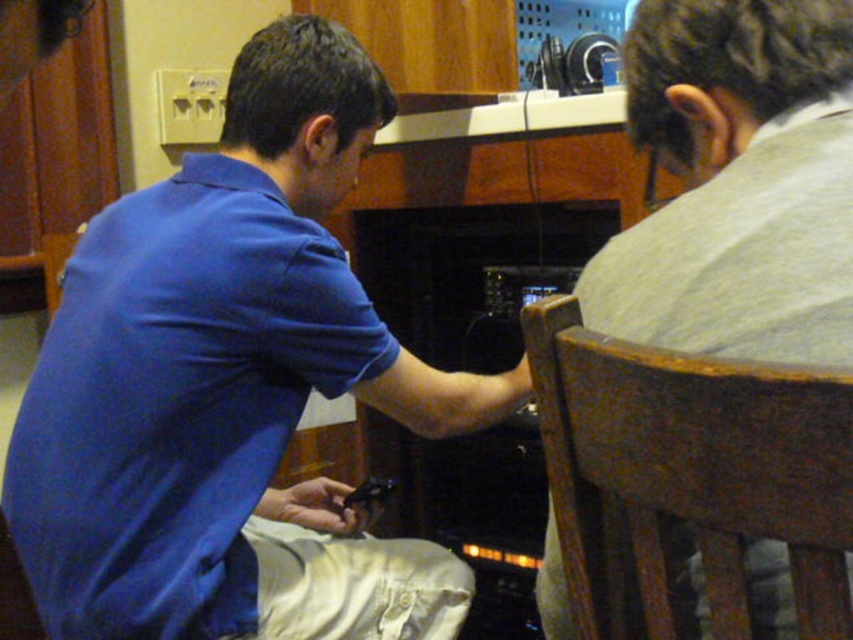
Question: Which of the following is the farthest from the observer?

Choices:
 (A) brown wood chair at right
 (B) blue cotton shirt at center

Answer: (B)

Question: Is blue cotton shirt at center below brown wood chair at right?

Choices:
 (A) yes
 (B) no

Answer: (B)

Question: Can you confirm if blue cotton shirt at center is positioned above brown wood chair at right?

Choices:
 (A) no
 (B) yes

Answer: (B)

Question: Is blue cotton shirt at center below brown wood chair at right?

Choices:
 (A) yes
 (B) no

Answer: (B)

Question: Which point appears farthest from the camera in this image?

Choices:
 (A) (285, 141)
 (B) (784, 396)

Answer: (A)